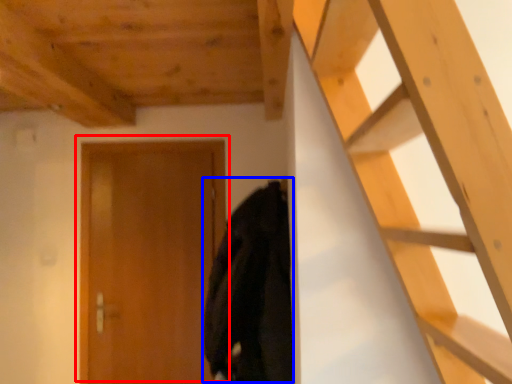
Question: Which point is closer to the camera, door (highlighted by a red box) or cloak (highlighted by a blue box)?

Choices:
 (A) door
 (B) cloak

Answer: (B)